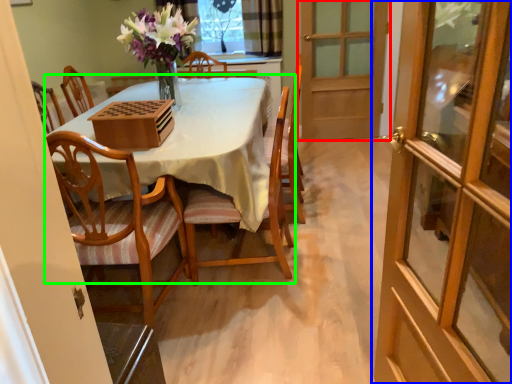
Question: Which object is positioned closest to door (highlighted by a red box)? Select from door (highlighted by a blue box) and kitchen & dining room table (highlighted by a green box).

Choices:
 (A) door
 (B) kitchen & dining room table

Answer: (A)